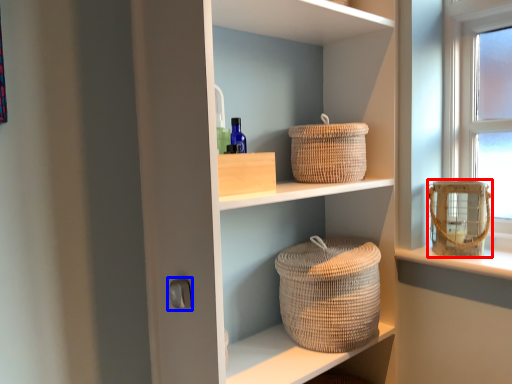
Question: Which of the following is the farthest to the observer, basket container (highlighted by a red box) or door handle (highlighted by a blue box)?

Choices:
 (A) basket container
 (B) door handle

Answer: (A)